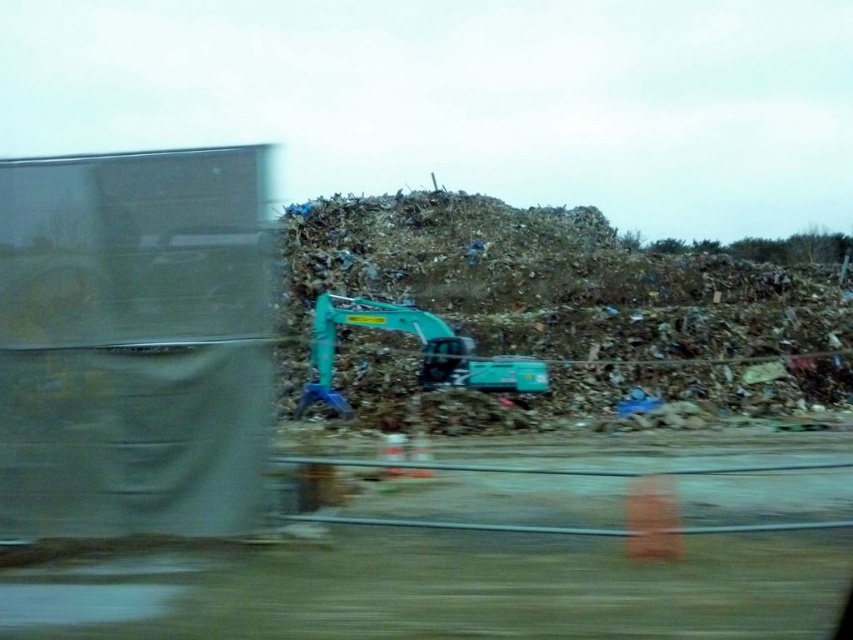
Question: Based on their relative distances, which object is nearer to the matte gray trailer truck at left?

Choices:
 (A) teal plastic excavator at center
 (B) teal rubber excavator at center

Answer: (B)

Question: Which object appears farthest from the camera in this image?

Choices:
 (A) teal rubber excavator at center
 (B) teal plastic excavator at center

Answer: (A)

Question: Is matte gray trailer truck at left to the right of teal rubber excavator at center from the viewer's perspective?

Choices:
 (A) yes
 (B) no

Answer: (A)

Question: Which object is closer to the camera taking this photo?

Choices:
 (A) matte gray trailer truck at left
 (B) teal plastic excavator at center
 (C) teal rubber excavator at center

Answer: (A)

Question: Is teal plastic excavator at center thinner than teal rubber excavator at center?

Choices:
 (A) yes
 (B) no

Answer: (B)

Question: Considering the relative positions of matte gray trailer truck at left and teal rubber excavator at center in the image provided, where is matte gray trailer truck at left located with respect to teal rubber excavator at center?

Choices:
 (A) right
 (B) left

Answer: (A)